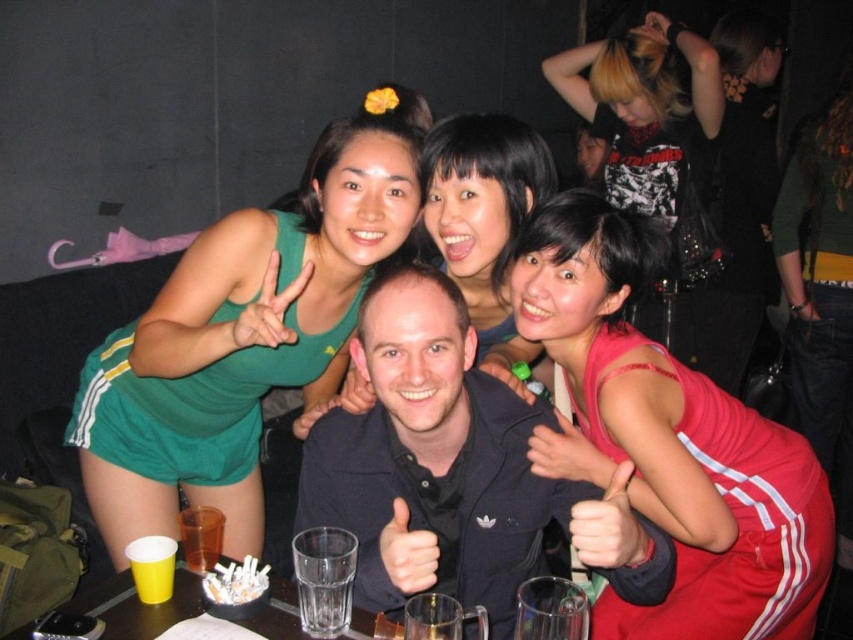
Question: Which object is the farthest from the yellow plastic cup at lower left?

Choices:
 (A) green jersey at upper left
 (B) translucent plastic cup at lower left
 (C) red shiny dress at center

Answer: (A)

Question: Is matte black dress at upper right bigger than translucent plastic cup at lower left?

Choices:
 (A) yes
 (B) no

Answer: (A)

Question: Which of the following is the closest to the observer?

Choices:
 (A) (552, 184)
 (B) (218, 310)
 (C) (759, 490)
 (D) (648, 72)

Answer: (C)

Question: Which object is closer to the camera taking this photo?

Choices:
 (A) green fabric dress at upper left
 (B) red shiny dress at center
 (C) translucent plastic cup at lower left

Answer: (A)

Question: Does yellow plastic cup at lower left come in front of translucent plastic cup at lower left?

Choices:
 (A) no
 (B) yes

Answer: (B)

Question: Can you confirm if red shiny dress at center is wider than yellow plastic cup at lower left?

Choices:
 (A) no
 (B) yes

Answer: (B)